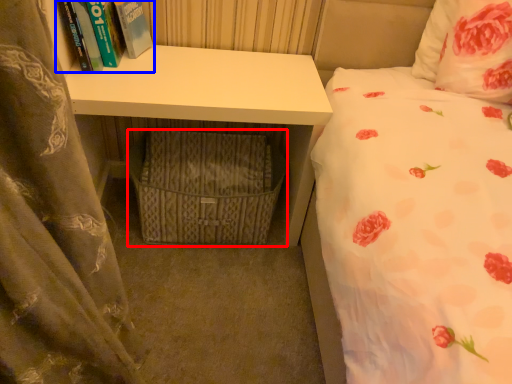
Question: Among these objects, which one is nearest to the camera, crate (highlighted by a red box) or book (highlighted by a blue box)?

Choices:
 (A) crate
 (B) book

Answer: (B)